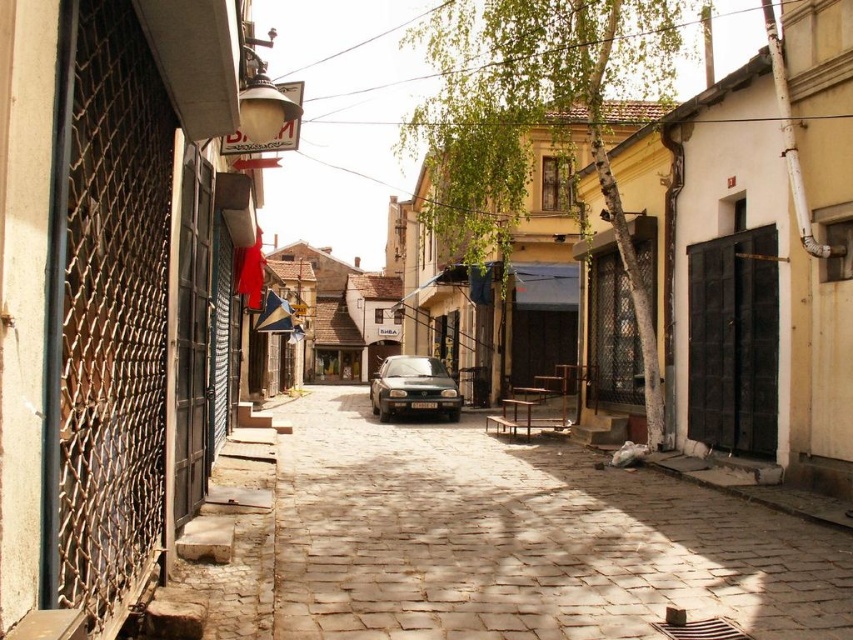
Question: Can you confirm if brown cobblestone alley at center is positioned to the right of satin black car at center?

Choices:
 (A) no
 (B) yes

Answer: (B)

Question: Does brown cobblestone alley at center lie behind satin black car at center?

Choices:
 (A) no
 (B) yes

Answer: (A)

Question: Is brown cobblestone alley at center bigger than satin black car at center?

Choices:
 (A) yes
 (B) no

Answer: (B)